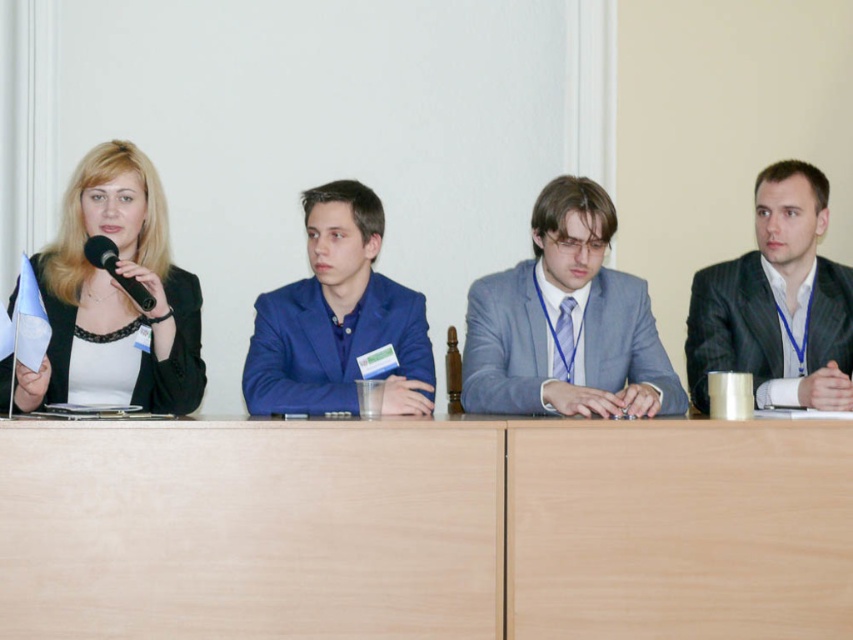
You are an event planner organizing a photoshoot for the panel discussion. You need to position a spotlight above the light gray suit at center and another spotlight above the blue satin suit at center. According to the scene description, can both spotlights be placed directly above their respective suits without overlapping?

The light gray suit at center is located above the blue satin suit at center, so placing a spotlight above each would require positioning them vertically. Since the light gray suit is above the blue satin suit, the spotlights can be placed directly above each without overlapping as they are in different vertical positions.

You are organizing a conference and need to ensure that the blue satin suit at center and the black plastic microphone at left can both fit on a 1.2 meter wide table. Based on their sizes, will they fit comfortably?

The blue satin suit at center is larger in size than the black plastic microphone at left. Since the total width required for both items would depend on their individual sizes, but given that the suit is larger, it might exceed the 1.2 meter width. However, without exact measurements, it is uncertain. Please check the actual dimensions.

You are a photographer taking a photo of the panel discussion. You need to ensure that the matte black jacket at left and the black textured suit at right are both visible in the frame. Based on their positions, which one is closer to the camera?

The matte black jacket at left is in front of the black textured suit at right, so it is closer to the camera.